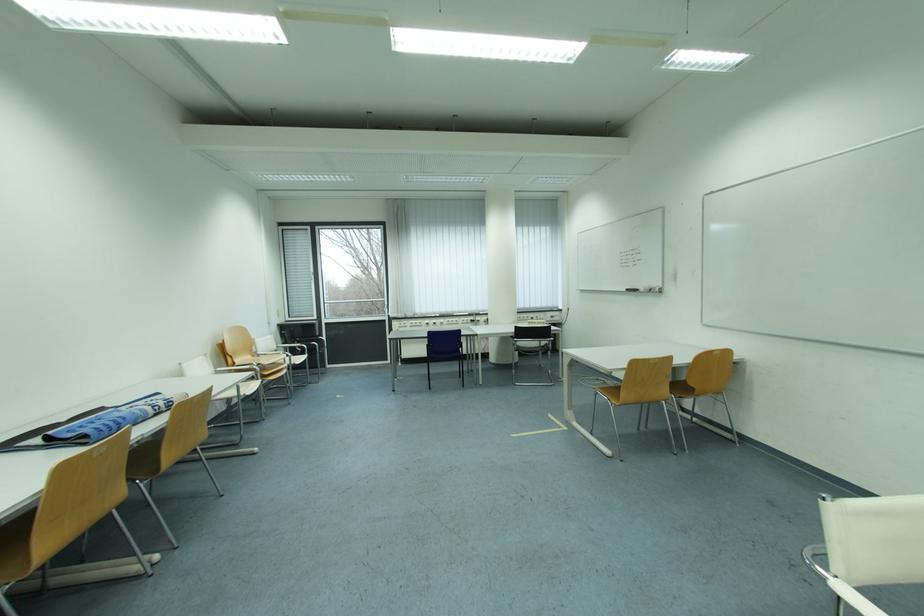
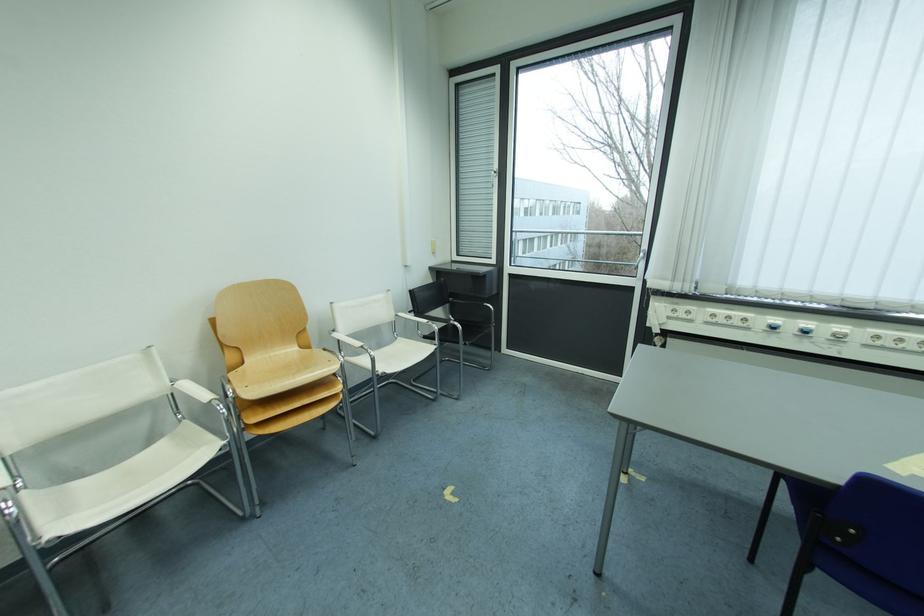
In the second image, find the point that corresponds to (424,325) in the first image.

(737, 320)